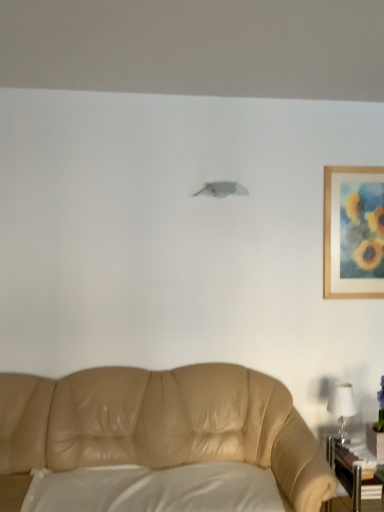
The image size is (384, 512). In order to click on white matte lampshade at upper center in this screenshot , I will do `click(222, 189)`.

What do you see at coordinates (162, 424) in the screenshot?
I see `tan leather couch at lower left` at bounding box center [162, 424].

What is the approximate width of white glossy table lamp at right?

The width of white glossy table lamp at right is 6.67 inches.

What do you see at coordinates (353, 232) in the screenshot? The image size is (384, 512). I see `wooden framed painting at upper right` at bounding box center [353, 232].

This screenshot has height=512, width=384. Describe the element at coordinates (157, 489) in the screenshot. I see `white matte pillow at lower center` at that location.

This screenshot has height=512, width=384. Find the location of `metallic silver table at lower right`. metallic silver table at lower right is located at coordinates (351, 471).

This screenshot has width=384, height=512. I want to click on white matte lampshade at upper center, so click(x=222, y=189).

Considering the relative sizes of wooden framed painting at upper right and white matte pillow at lower center in the image provided, is wooden framed painting at upper right thinner than white matte pillow at lower center?

Yes, wooden framed painting at upper right is thinner than white matte pillow at lower center.

Is wooden framed painting at upper right oriented away from white matte pillow at lower center?

That's not correct — wooden framed painting at upper right is not looking away from white matte pillow at lower center.

Looking at this image, based on their positions, is wooden framed painting at upper right located to the left or right of white matte pillow at lower center?

wooden framed painting at upper right is to the right of white matte pillow at lower center.

Who is shorter, white matte lampshade at upper center or white glossy table lamp at right?

white matte lampshade at upper center.

The width and height of the screenshot is (384, 512). Identify the location of lamp located on the left of white glossy table lamp at right. (222, 189).

Which is in front, white matte lampshade at upper center or white glossy table lamp at right?

white glossy table lamp at right.

From a real-world perspective, does white matte lampshade at upper center stand above white glossy table lamp at right?

Yes, from a real-world perspective, white matte lampshade at upper center is above white glossy table lamp at right.

Is white matte lampshade at upper center oriented away from wooden framed painting at upper right?

No, wooden framed painting at upper right is not at the back of white matte lampshade at upper center.

Considering the positions of point (215, 191) and point (342, 193), is point (215, 191) closer or farther from the camera than point (342, 193)?

Point (215, 191) appears to be closer to the viewer than point (342, 193).

Considering the sizes of objects white matte lampshade at upper center and wooden framed painting at upper right in the image provided, who is shorter, white matte lampshade at upper center or wooden framed painting at upper right?

white matte lampshade at upper center.

Considering the sizes of objects white matte lampshade at upper center and wooden framed painting at upper right in the image provided, who is wider, white matte lampshade at upper center or wooden framed painting at upper right?

white matte lampshade at upper center is wider.

Is metallic silver table at lower right completely or partially outside of wooden framed painting at upper right?

Indeed, metallic silver table at lower right is completely outside wooden framed painting at upper right.

From a real-world perspective, between metallic silver table at lower right and wooden framed painting at upper right, who is vertically lower?

In real-world perspective, metallic silver table at lower right is lower.

Based on the photo, is metallic silver table at lower right aimed at wooden framed painting at upper right?

No.

Can you confirm if wooden framed painting at upper right is positioned to the right of metallic silver table at lower right?

Yes.

Is wooden framed painting at upper right situated inside metallic silver table at lower right or outside?

The correct answer is: outside.

Is wooden framed painting at upper right aimed at metallic silver table at lower right?

No.

Is metallic silver table at lower right with white glossy table lamp at right?

No, metallic silver table at lower right is not making contact with white glossy table lamp at right.

Would you say metallic silver table at lower right is inside or outside white glossy table lamp at right?

The correct answer is: outside.

Which is more to the left, metallic silver table at lower right or white glossy table lamp at right?

Positioned to the left is white glossy table lamp at right.

How far apart are metallic silver table at lower right and white glossy table lamp at right?

The distance of metallic silver table at lower right from white glossy table lamp at right is 7.77 inches.

Is white matte lampshade at upper center facing away from tan leather couch at lower left?

No, tan leather couch at lower left is not at the back of white matte lampshade at upper center.

Find the location of a particular element. Image resolution: width=384 pixels, height=512 pixels. lamp located above the tan leather couch at lower left (from the image's perspective) is located at coordinates click(x=222, y=189).

Considering the positions of objects white matte lampshade at upper center and tan leather couch at lower left in the image provided, who is in front, white matte lampshade at upper center or tan leather couch at lower left?

Positioned in front is tan leather couch at lower left.

Locate an element on the screen. picture frame above the white matte pillow at lower center (from the image's perspective) is located at coordinates (353, 232).

At what (x,y) coordinates should I click in order to perform the action: click on table lamp in front of the white matte lampshade at upper center. Please return your answer as a coordinate pair (x, y). The height and width of the screenshot is (512, 384). Looking at the image, I should click on (342, 407).

Estimate the real-world distances between objects in this image. Which object is further from white glossy table lamp at right, white matte lampshade at upper center or wooden framed painting at upper right?

Among the two, white matte lampshade at upper center is located further to white glossy table lamp at right.

Based on their spatial positions, is white glossy table lamp at right or tan leather couch at lower left closer to white matte lampshade at upper center?

tan leather couch at lower left is closer to white matte lampshade at upper center.

Based on their spatial positions, is white glossy table lamp at right or tan leather couch at lower left closer to wooden framed painting at upper right?

white glossy table lamp at right lies closer to wooden framed painting at upper right than the other object.

Based on their spatial positions, is tan leather couch at lower left or white glossy table lamp at right further from white matte pillow at lower center?

white glossy table lamp at right is positioned further to the anchor white matte pillow at lower center.

From the image, which object appears to be farther from white matte lampshade at upper center, tan leather couch at lower left or wooden framed painting at upper right?

tan leather couch at lower left lies further to white matte lampshade at upper center than the other object.

Which object lies further to the anchor point wooden framed painting at upper right, white glossy table lamp at right or white matte pillow at lower center?

white matte pillow at lower center is further to wooden framed painting at upper right.

Looking at the image, which one is located closer to white matte pillow at lower center, wooden framed painting at upper right or tan leather couch at lower left?

The object closer to white matte pillow at lower center is tan leather couch at lower left.

Based on their spatial positions, is tan leather couch at lower left or white matte pillow at lower center closer to white glossy table lamp at right?

tan leather couch at lower left is closer to white glossy table lamp at right.

Where is `pillow between white matte lampshade at upper center and metallic silver table at lower right vertically`? pillow between white matte lampshade at upper center and metallic silver table at lower right vertically is located at coordinates (157, 489).

Locate an element on the screen. The width and height of the screenshot is (384, 512). pillow located between tan leather couch at lower left and wooden framed painting at upper right in the depth direction is located at coordinates (157, 489).

Locate an element on the screen. lamp between tan leather couch at lower left and wooden framed painting at upper right along the z-axis is located at coordinates (222, 189).

This screenshot has height=512, width=384. I want to click on table located between tan leather couch at lower left and wooden framed painting at upper right in the depth direction, so click(x=351, y=471).